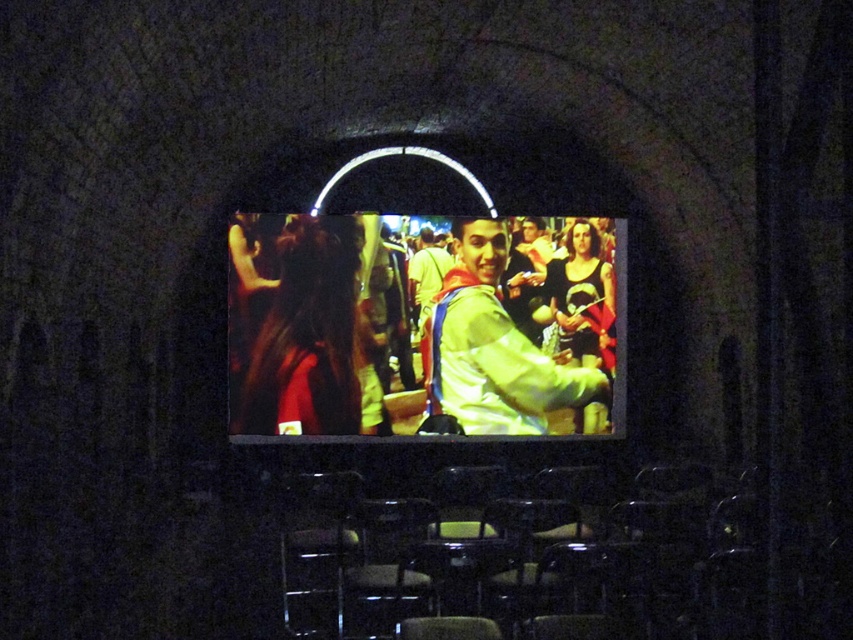
From the picture: You are standing in the theater and want to check if you can reach a point marked at coordinates point [494,381] on the screen. Your arm can extend up to 1.2 meters. Can you reach it?

The distance of point [494,381] from viewer is 8.73 meters, so no, you cannot reach it with an arm extension of 1.2 meters.

You are a costume designer working on a new project and need to know the exact position of the shiny silver jacket at center in the image. Can you confirm its coordinates?

The shiny silver jacket at center is located at point (419, 324).

You are an actor preparing to walk onto the stage. You see the shiny silver jacket at center and the light green fabric jacket at center on the screen. Which jacket would be more likely to catch the stage lights and why?

The shiny silver jacket at center would catch the stage lights more because it is wider and has a reflective surface, making it stand out compared to the light green fabric jacket at center.